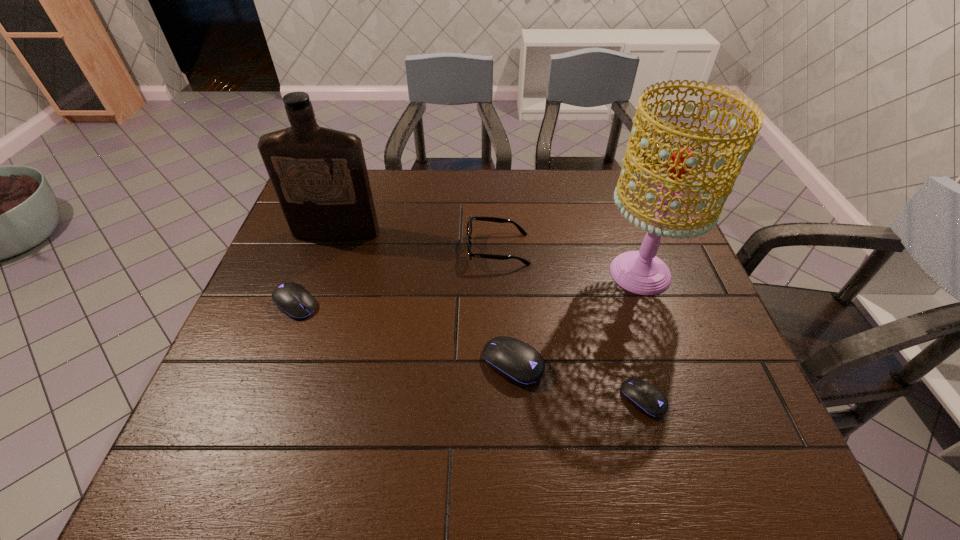
If the aim is uniform spacing by inserting an additional mouse_(computer_equipment) among them, please point to a vacant space for this new mouse_(computer_equipment). Please provide its 2D coordinates. Your answer should be formatted as a tuple, i.e. [(x, y)], where the tuple contains the x and y coordinates of a point satisfying the conditions above.

[(398, 332)]